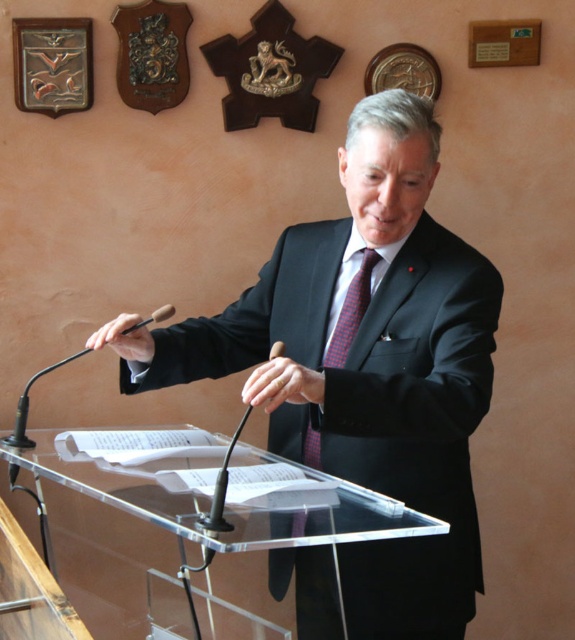
Is black glossy suit at center positioned behind transparent acrylic podium at center?

Yes.

Can you confirm if black glossy suit at center is shorter than transparent acrylic podium at center?

No.

Is point (423, 579) less distant than point (310, 506)?

That is False.

Image resolution: width=575 pixels, height=640 pixels. Identify the location of black glossy suit at center. (365, 364).

Identify the location of transparent acrylic podium at center. This screenshot has width=575, height=640. (x=233, y=506).

Between black glossy suit at center and red checkered tie at center, which one has more height?

black glossy suit at center is taller.

Can you confirm if black glossy suit at center is positioned below red checkered tie at center?

Indeed, black glossy suit at center is positioned under red checkered tie at center.

Where is `black glossy suit at center`? black glossy suit at center is located at coordinates 365,364.